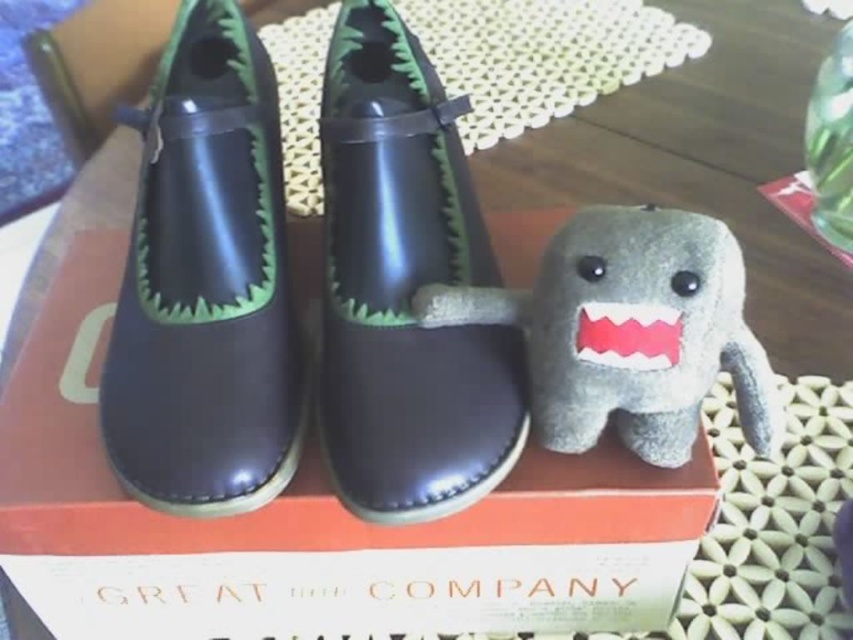
This screenshot has height=640, width=853. Find the location of `shiny black shoe at left`. shiny black shoe at left is located at coordinates (206, 284).

Does shiny black shoe at left have a larger size compared to shiny black shoe at center?

Yes.

Who is more forward, (230, 461) or (399, 141)?

Positioned in front is point (230, 461).

The width and height of the screenshot is (853, 640). What are the coordinates of `shiny black shoe at left` in the screenshot? It's located at (206, 284).

Does shiny black shoe at left have a lesser height compared to gray plush toy at center?

In fact, shiny black shoe at left may be taller than gray plush toy at center.

Looking at this image, which is above, shiny black shoe at left or gray plush toy at center?

shiny black shoe at left is above.

Is point (149, 410) farther from viewer compared to point (618, 294)?

Yes, it is.

In order to click on shiny black shoe at left in this screenshot , I will do `click(206, 284)`.

Is shiny black shoe at center further to camera compared to gray plush toy at center?

Yes.

Is the position of shiny black shoe at center less distant than that of gray plush toy at center?

No, shiny black shoe at center is behind gray plush toy at center.

Between point (404, 72) and point (543, 410), which one is positioned in front?

Point (543, 410)

Where is `shiny black shoe at center`? The image size is (853, 640). shiny black shoe at center is located at coordinates (405, 285).